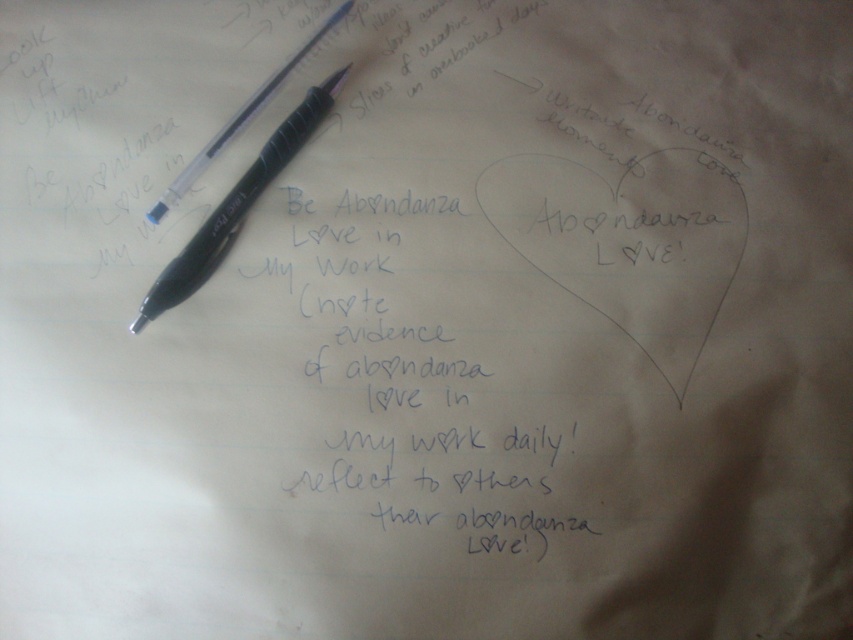
Looking at this image, who is more forward, (279, 170) or (321, 29)?

Point (279, 170) is in front.

Is black plastic pen at upper left to the right of matte black pen at upper left from the viewer's perspective?

Incorrect, black plastic pen at upper left is not on the right side of matte black pen at upper left.

Image resolution: width=853 pixels, height=640 pixels. In order to click on black plastic pen at upper left in this screenshot , I will do `click(236, 205)`.